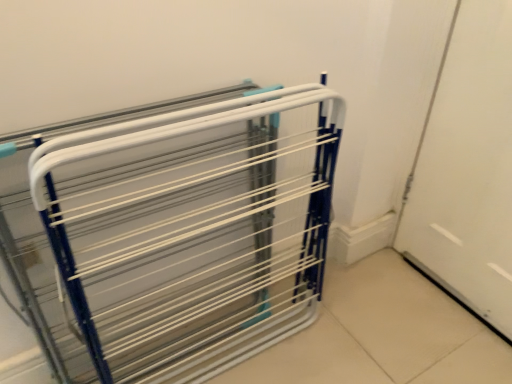
The image size is (512, 384). Identify the location of white plastic drying rack at center. (174, 232).

Describe the element at coordinates (174, 232) in the screenshot. I see `white plastic drying rack at center` at that location.

In order to click on white plastic drying rack at center in this screenshot , I will do `click(174, 232)`.